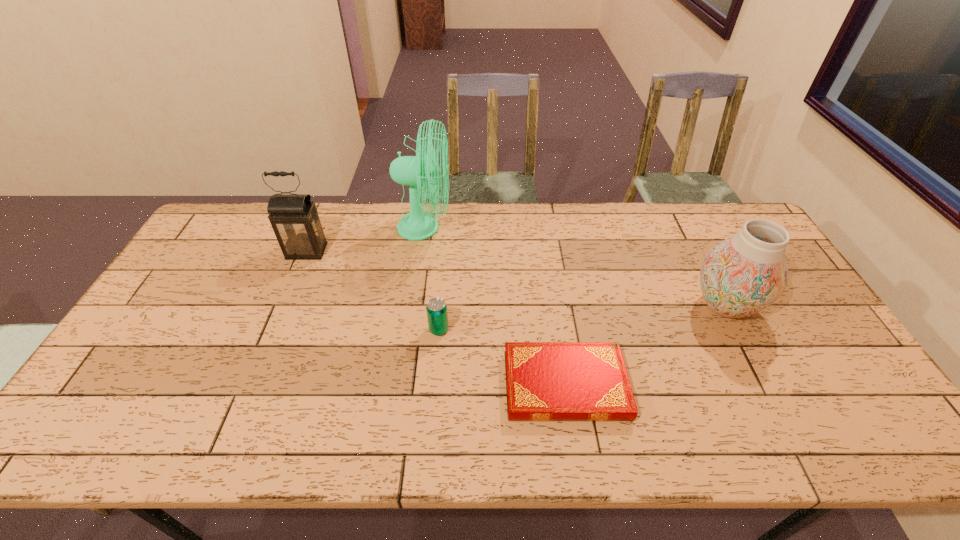
Find the location of a particular element. free space in the image that satisfies the following two spatial constraints: 1. in front of the tallest object to blow air; 2. on the front-facing side of the lantern is located at coordinates (421, 251).

Identify the location of free space that satisfies the following two spatial constraints: 1. on the back side of the rightmost object; 2. in front of the tallest object to blow air. This screenshot has height=540, width=960. coord(684,228).

Locate an element on the screen. This screenshot has width=960, height=540. free location that satisfies the following two spatial constraints: 1. in front of the beer can to blow air; 2. on the left side of the tallest object is located at coordinates (410, 329).